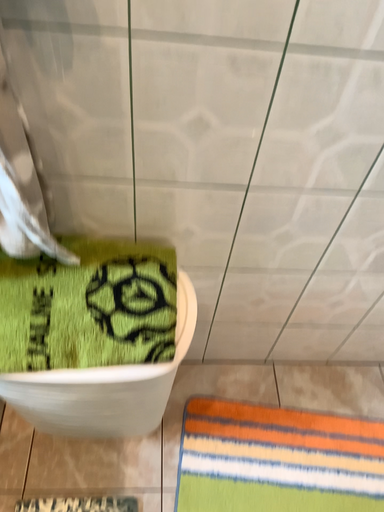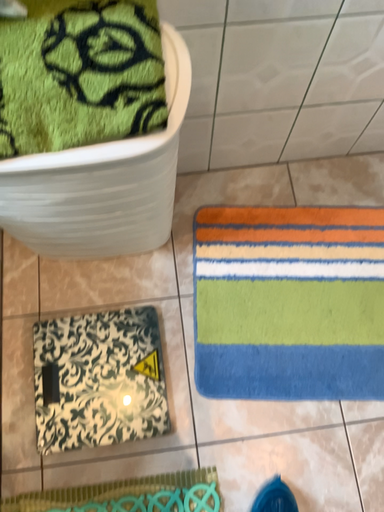
Question: How did the camera likely rotate when shooting the video?

Choices:
 (A) rotated downward
 (B) rotated upward

Answer: (A)